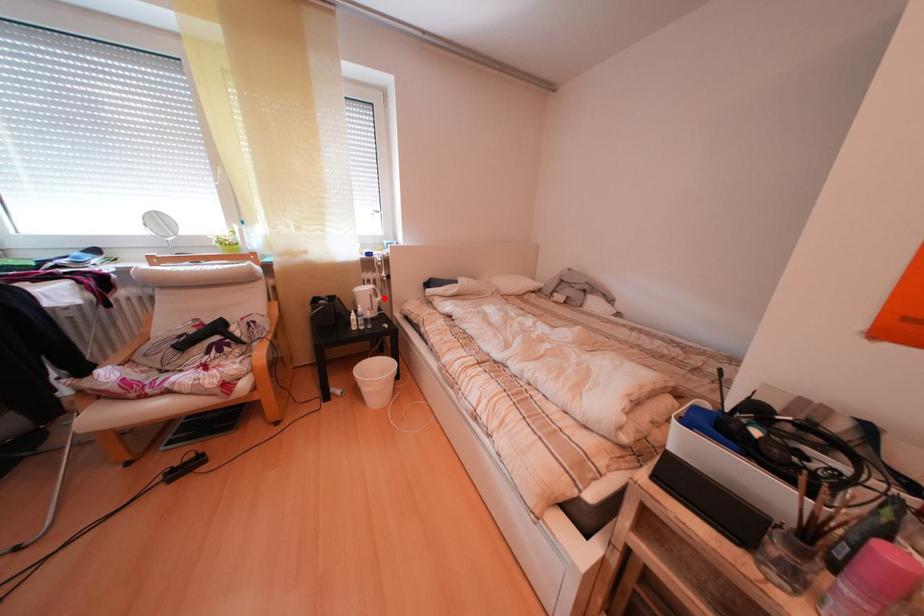
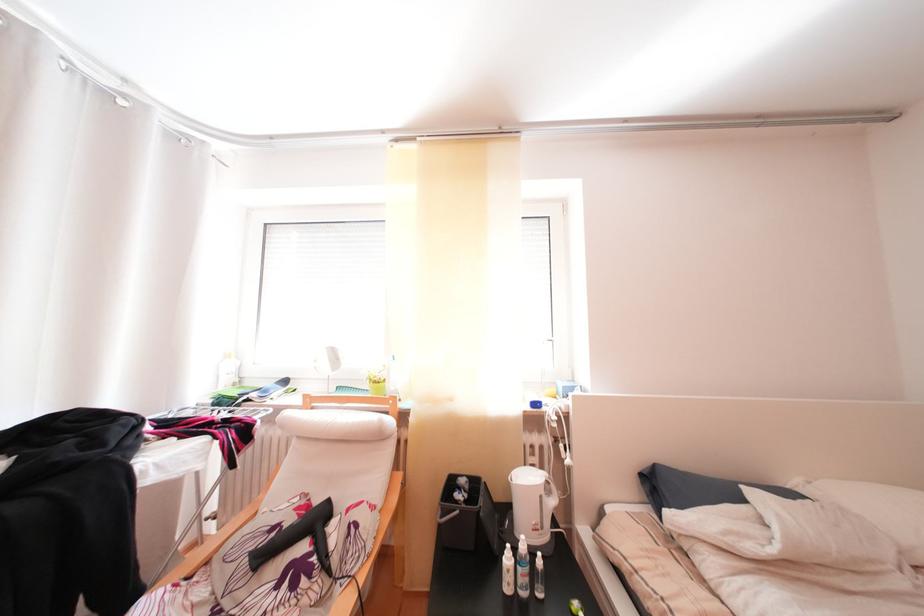
Where in the second image is the point corresponding to the highlighted location from the first image?

(554, 498)